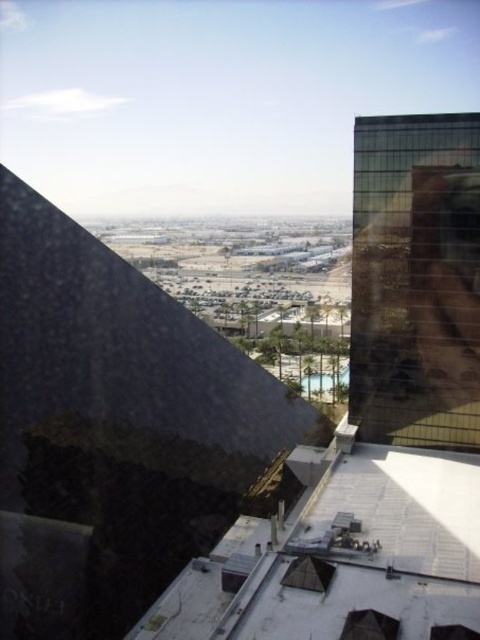
You are standing on the rooftop of the pyramid structure and want to visit the green reflective glass building at right. If you walk directly towards it, how far will you have to walk?

The green reflective glass building at right is 40.83 meters away from the viewer, so you will have to walk 40.83 meters to reach it.

You are standing on the rooftop and looking down. You see the green reflective glass building at right and the transparent glass window at center. Which object is higher from the ground?

The green reflective glass building at right is positioned over the transparent glass window at center, so it is higher from the ground.